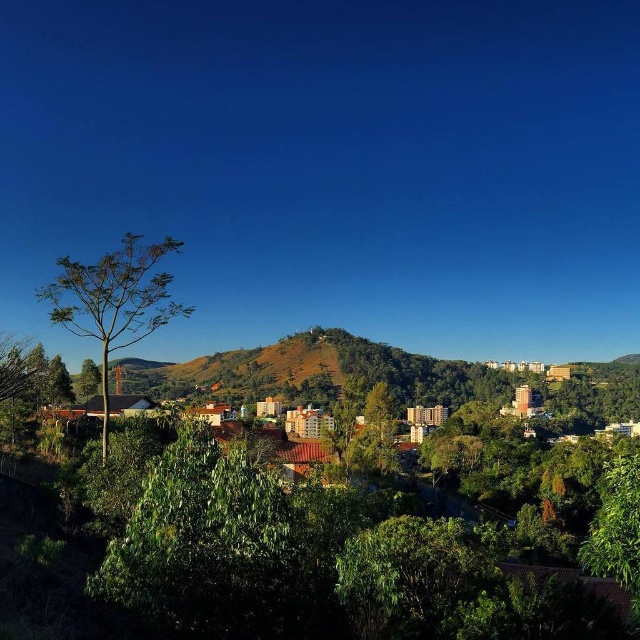
You are standing in the middle of the landscape and see the green leafy tree at left and the green leafy tree at lower right. Which tree is located more to the left?

The green leafy tree at left is positioned on the left side of green leafy tree at lower right, so it is more to the left.

You are a drone operator trying to capture a photo of the green glossy tree at center and the green leafy tree at left. Which tree should you adjust your drone to focus on first if you want to start with the one that is nearer to the camera?

The green glossy tree at center is closer to the viewer than the green leafy tree at left, so you should focus on the green glossy tree at center first.